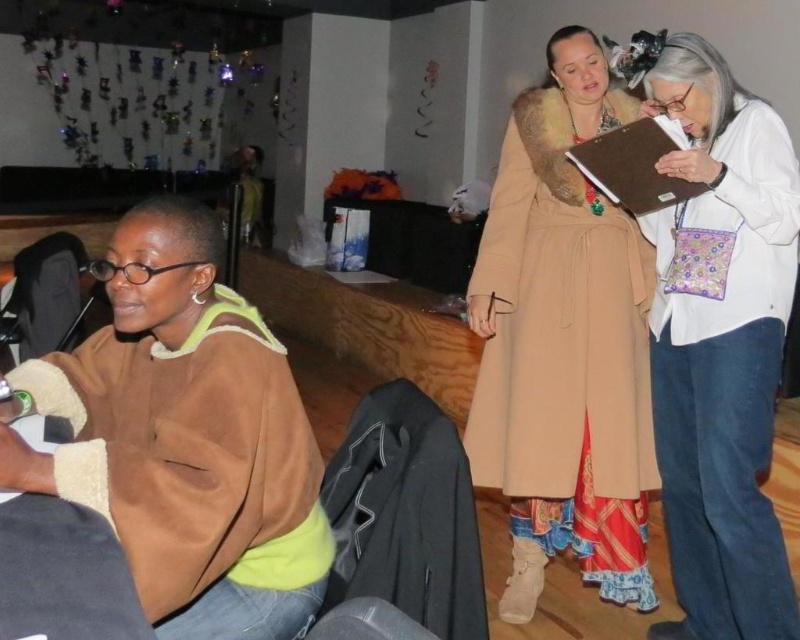
Is suede brown sweater at lower left below brown paper clipboard at upper right?

Yes.

Between suede brown sweater at lower left and brown paper clipboard at upper right, which one has less height?

brown paper clipboard at upper right

Between point (30, 461) and point (670, 144), which one is positioned in front?

Point (30, 461) is in front.

This screenshot has width=800, height=640. Identify the location of suede brown sweater at lower left. (186, 436).

Can you confirm if suede brown sweater at lower left is bigger than white cotton purse at right?

No.

Does suede brown sweater at lower left lie in front of white cotton purse at right?

That is True.

Is point (296, 518) positioned after point (660, 90)?

No.

You are a GUI agent. You are given a task and a screenshot of the screen. Output one action in this format:
    pyautogui.click(x=<x>, y=<y>)
    Task: Click on the suede brown sweater at lower left
    The width and height of the screenshot is (800, 640).
    Given the screenshot: What is the action you would take?
    pyautogui.click(x=186, y=436)

The image size is (800, 640). I want to click on beige wool coat at center, so click(564, 344).

Locate an element on the screen. This screenshot has width=800, height=640. beige wool coat at center is located at coordinates [564, 344].